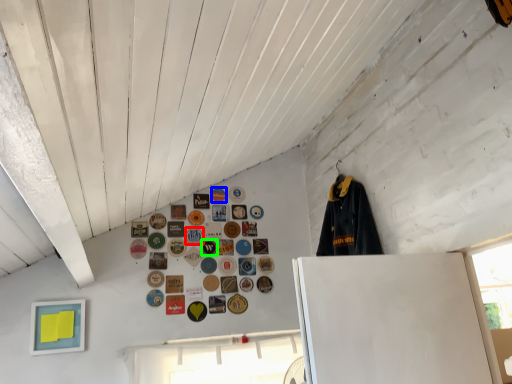
Question: Estimate the real-world distances between objects in this image. Which object is farther from button (highlighted by a red box), button (highlighted by a blue box) or button (highlighted by a green box)?

Choices:
 (A) button
 (B) button

Answer: (A)